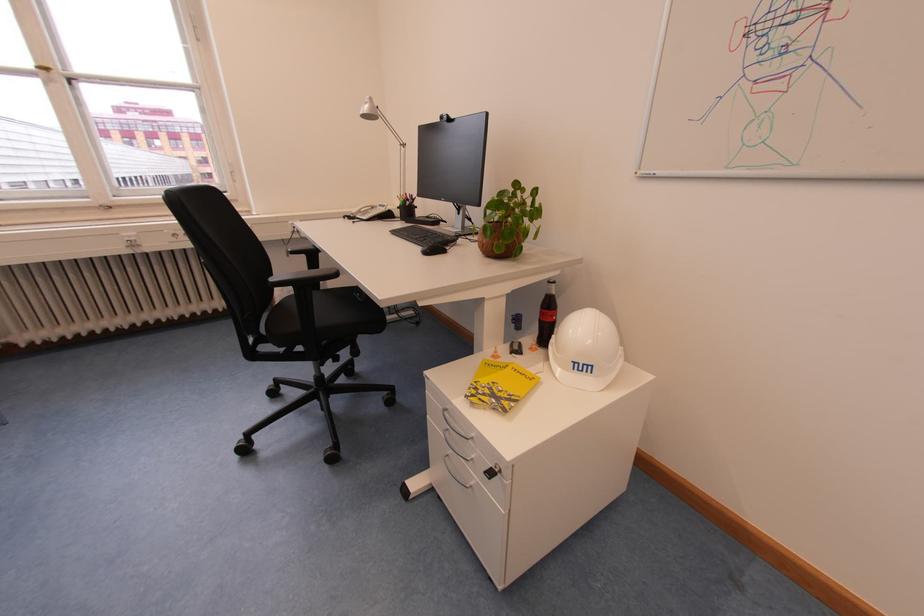
Find the location of a particular element. yellow booklet is located at coordinates pos(499,385).